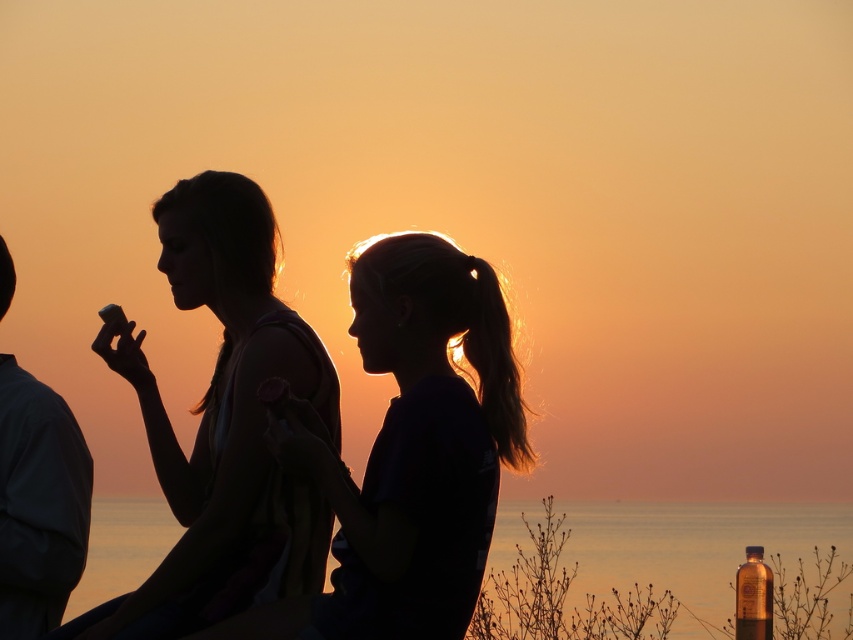
Question: Which point appears closest to the camera in this image?

Choices:
 (A) (306, 588)
 (B) (24, 465)
 (C) (769, 608)
 (D) (503, 438)

Answer: (D)

Question: Which object is positioned closest to the translucent amber bottle at lower right?

Choices:
 (A) silhouette hair at center
 (B) silhouette fabric at center

Answer: (B)

Question: Can you confirm if silhouette hair at center is positioned to the right of smooth fabric shirt at left?

Choices:
 (A) yes
 (B) no

Answer: (A)

Question: Based on their relative distances, which object is farther from the translucent amber bottle at lower right?

Choices:
 (A) silhouette hair at center
 (B) smooth fabric shirt at left
 (C) silhouette fabric at center

Answer: (B)

Question: Does silhouette hair at center have a greater width compared to silhouette fabric at center?

Choices:
 (A) yes
 (B) no

Answer: (B)

Question: Is silhouette hair at center to the right of smooth fabric shirt at left from the viewer's perspective?

Choices:
 (A) no
 (B) yes

Answer: (B)